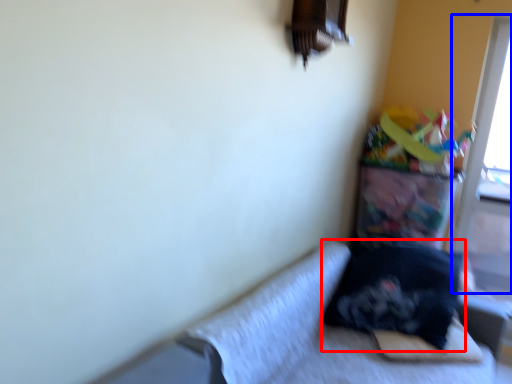
Question: Which of the following is the farthest to the observer, pillow (highlighted by a red box) or screen door (highlighted by a blue box)?

Choices:
 (A) pillow
 (B) screen door

Answer: (B)